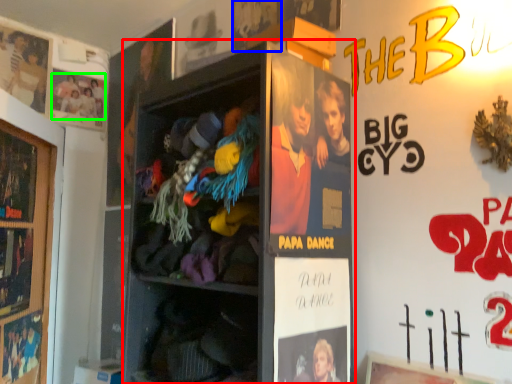
Question: Which object is the farthest from shelf (highlighted by a red box)? Choose among these: movie poster (highlighted by a blue box) or person (highlighted by a green box).

Choices:
 (A) movie poster
 (B) person

Answer: (B)